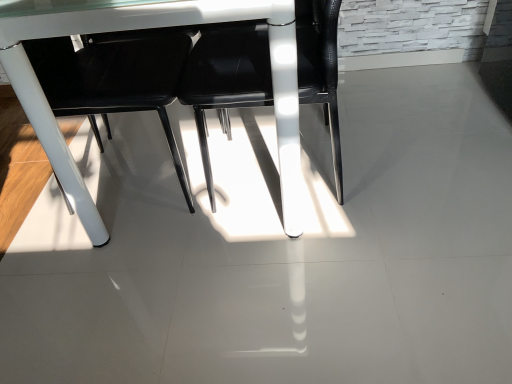
The width and height of the screenshot is (512, 384). Find the location of `white glossy table at center`. white glossy table at center is located at coordinates (149, 28).

Where is `black leather chair at center, which is the first chair from right to left`? The width and height of the screenshot is (512, 384). black leather chair at center, which is the first chair from right to left is located at coordinates (226, 80).

This screenshot has height=384, width=512. I want to click on white glossy table at center, so click(149, 28).

From the image's perspective, which is above, black leather chair at center, the 2th chair positioned from the right, or white glossy table at center?

white glossy table at center.

Which of these two, black leather chair at center, which is the 1th chair from left to right, or white glossy table at center, is thinner?

With smaller width is black leather chair at center, which is the 1th chair from left to right.

Is black leather chair at center, which is the 1th chair from left to right, taller or shorter than white glossy table at center?

Considering their sizes, black leather chair at center, which is the 1th chair from left to right, has less height than white glossy table at center.

Which of these two, black leather chair at center, the 2th chair positioned from the right, or black leather chair at center, which is the first chair from right to left, stands taller?

With more height is black leather chair at center, the 2th chair positioned from the right.

Which object is thinner, black leather chair at center, the 2th chair positioned from the right, or black leather chair at center, which appears as the 2th chair when viewed from the left?

With smaller width is black leather chair at center, which appears as the 2th chair when viewed from the left.

Consider the image. What's the angular difference between black leather chair at center, the 2th chair positioned from the right, and black leather chair at center, which appears as the 2th chair when viewed from the left,'s facing directions?

179 degrees separate the facing orientations of black leather chair at center, the 2th chair positioned from the right, and black leather chair at center, which appears as the 2th chair when viewed from the left.

I want to click on chair located on the left of black leather chair at center, which appears as the 2th chair when viewed from the left, so click(113, 80).

Is black leather chair at center, which appears as the 2th chair when viewed from the left, wider or thinner than white glossy table at center?

black leather chair at center, which appears as the 2th chair when viewed from the left, is thinner than white glossy table at center.

From a real-world perspective, is black leather chair at center, which is the first chair from right to left, positioned above or below white glossy table at center?

black leather chair at center, which is the first chair from right to left, is situated lower than white glossy table at center in the real world.

Consider the image. Considering the relative sizes of black leather chair at center, which appears as the 2th chair when viewed from the left, and white glossy table at center in the image provided, is black leather chair at center, which appears as the 2th chair when viewed from the left, bigger than white glossy table at center?

No.

Is point (334, 131) farther from camera compared to point (23, 18)?

Yes.

Is black leather chair at center, which appears as the 2th chair when viewed from the left, further to the viewer compared to black leather chair at center, which is the 1th chair from left to right?

No, the depth of black leather chair at center, which appears as the 2th chair when viewed from the left, is less than that of black leather chair at center, which is the 1th chair from left to right.

Which is in front, point (335, 179) or point (116, 110)?

The point (335, 179) is in front.

Which of these two, white glossy table at center or black leather chair at center, which is the 1th chair from left to right, stands taller?

white glossy table at center is taller.

From the image's perspective, is white glossy table at center on black leather chair at center, which is the 1th chair from left to right?

Yes, from the image's perspective, white glossy table at center is above black leather chair at center, which is the 1th chair from left to right.

Which object is thinner, white glossy table at center or black leather chair at center, the 2th chair positioned from the right?

With smaller width is black leather chair at center, the 2th chair positioned from the right.

Is black leather chair at center, which is the 1th chair from left to right, at the back of white glossy table at center?

Yes.

Is the depth of white glossy table at center greater than that of black leather chair at center, which appears as the 2th chair when viewed from the left?

No, it is not.

Which object is wider, white glossy table at center or black leather chair at center, which appears as the 2th chair when viewed from the left?

With larger width is white glossy table at center.

Between white glossy table at center and black leather chair at center, which appears as the 2th chair when viewed from the left, which one has less height?

black leather chair at center, which appears as the 2th chair when viewed from the left.

The image size is (512, 384). I want to click on chair on the left side of white glossy table at center, so click(x=113, y=80).

Locate an element on the screen. The image size is (512, 384). chair that is below the black leather chair at center, which is the 1th chair from left to right (from the image's perspective) is located at coordinates (226, 80).

Looking at the image, which one is located further to black leather chair at center, which is the 1th chair from left to right, black leather chair at center, which is the first chair from right to left, or white glossy table at center?

white glossy table at center is further to black leather chair at center, which is the 1th chair from left to right.

Estimate the real-world distances between objects in this image. Which object is closer to black leather chair at center, which appears as the 2th chair when viewed from the left, black leather chair at center, the 2th chair positioned from the right, or white glossy table at center?

The object closer to black leather chair at center, which appears as the 2th chair when viewed from the left, is black leather chair at center, the 2th chair positioned from the right.

From the picture: Estimate the real-world distances between objects in this image. Which object is further from black leather chair at center, the 2th chair positioned from the right, white glossy table at center or black leather chair at center, which appears as the 2th chair when viewed from the left?

Among the two, white glossy table at center is located further to black leather chair at center, the 2th chair positioned from the right.

From the image, which object appears to be farther from white glossy table at center, black leather chair at center, the 2th chair positioned from the right, or black leather chair at center, which appears as the 2th chair when viewed from the left?

Among the two, black leather chair at center, the 2th chair positioned from the right, is located further to white glossy table at center.

From the image, which object appears to be farther from white glossy table at center, black leather chair at center, which appears as the 2th chair when viewed from the left, or black leather chair at center, which is the 1th chair from left to right?

The object further to white glossy table at center is black leather chair at center, which is the 1th chair from left to right.

Based on their spatial positions, is white glossy table at center or black leather chair at center, which is the 1th chair from left to right, further from black leather chair at center, which is the first chair from right to left?

Based on the image, white glossy table at center appears to be further to black leather chair at center, which is the first chair from right to left.

You are a GUI agent. You are given a task and a screenshot of the screen. Output one action in this format:
    pyautogui.click(x=<x>, y=<y>)
    Task: Click on the table between black leather chair at center, which is the 1th chair from left to right, and black leather chair at center, which is the first chair from right to left, from left to right
    Image resolution: width=512 pixels, height=384 pixels.
    Given the screenshot: What is the action you would take?
    pyautogui.click(x=149, y=28)